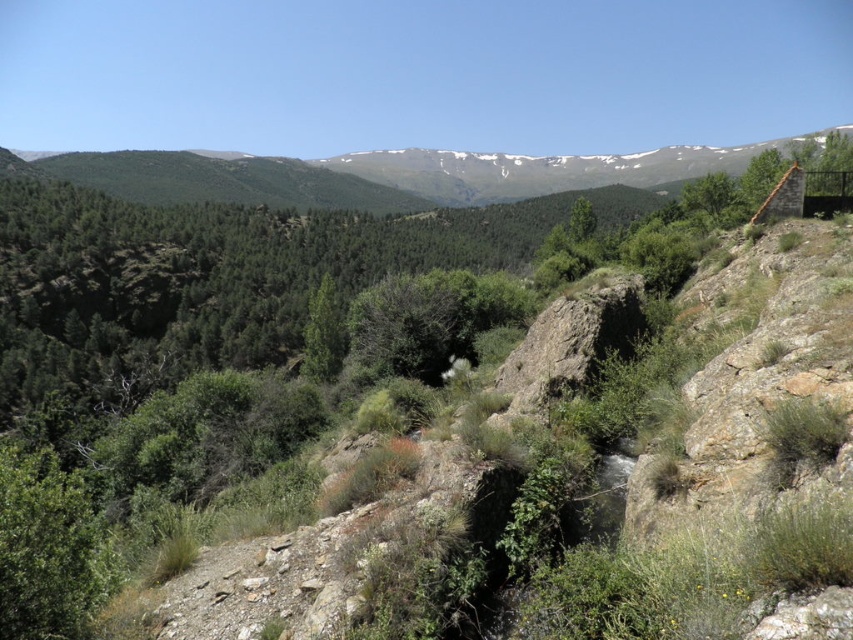
Question: From the image, what is the correct spatial relationship of green forested mountain at upper center in relation to green rough bark tree at upper right?

Choices:
 (A) right
 (B) left

Answer: (B)

Question: Is green forested mountain at upper center above green rough bark tree at upper right?

Choices:
 (A) no
 (B) yes

Answer: (B)

Question: Which point is farther to the camera?

Choices:
 (A) (422, 180)
 (B) (778, 150)

Answer: (A)

Question: Is green forested mountain at upper center behind green rough bark tree at upper right?

Choices:
 (A) no
 (B) yes

Answer: (B)